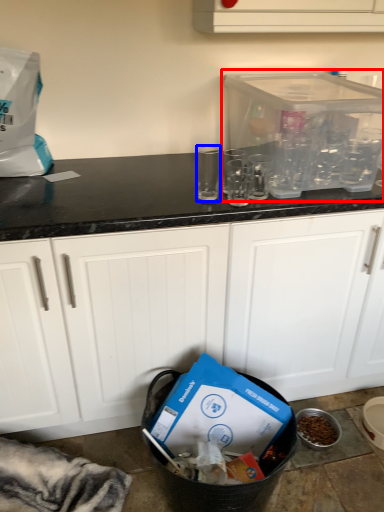
Question: Which point is further to the camera, appliance (highlighted by a red box) or clear (highlighted by a blue box)?

Choices:
 (A) appliance
 (B) clear

Answer: (B)